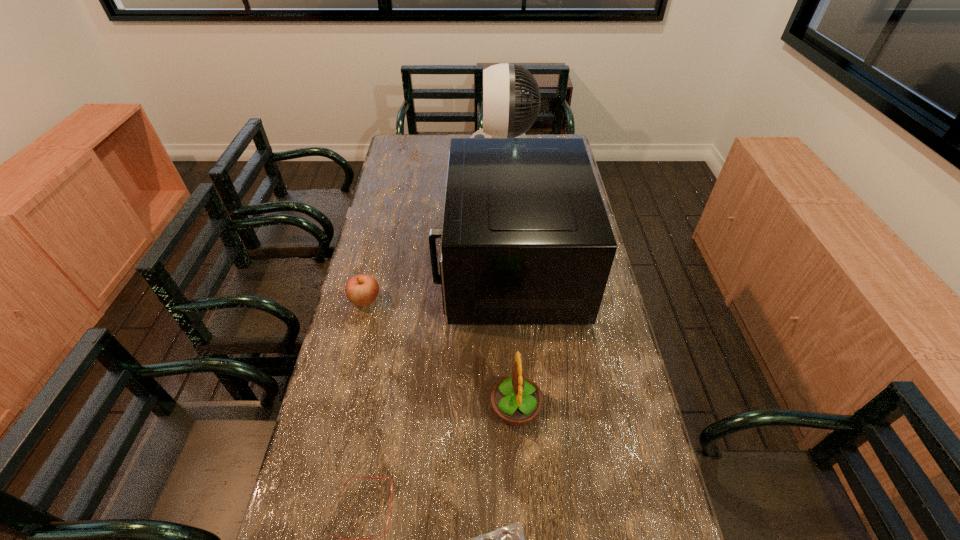
The image size is (960, 540). What are the coordinates of `fan` in the screenshot? It's located at (501, 101).

Image resolution: width=960 pixels, height=540 pixels. In order to click on microwave_oven in this screenshot , I will do `click(526, 239)`.

I want to click on the fourth farthest object, so click(516, 400).

Find the location of a particular element. sunflower is located at coordinates pyautogui.click(x=516, y=400).

You are a GUI agent. You are given a task and a screenshot of the screen. Output one action in this format:
    pyautogui.click(x=<x>, y=<y>)
    Task: Click on the fourth tallest object
    This screenshot has height=540, width=960.
    Given the screenshot: What is the action you would take?
    pyautogui.click(x=361, y=290)

You are a GUI agent. You are given a task and a screenshot of the screen. Output one action in this format:
    pyautogui.click(x=<x>, y=<y>)
    Task: Click on the apple
    The image size is (960, 540).
    Given the screenshot: What is the action you would take?
    (x=361, y=290)

The height and width of the screenshot is (540, 960). I want to click on free region located 0.160m on the grille of the fan, so click(434, 151).

Image resolution: width=960 pixels, height=540 pixels. Find the location of `vacant space located on the grille of the fan`. vacant space located on the grille of the fan is located at coordinates (453, 151).

The width and height of the screenshot is (960, 540). Find the location of `vacant region located on the grille of the fan`. vacant region located on the grille of the fan is located at coordinates (446, 151).

Locate an element on the screen. The width and height of the screenshot is (960, 540). vacant area situated 0.070m on the front-facing side of the microwave_oven is located at coordinates (419, 266).